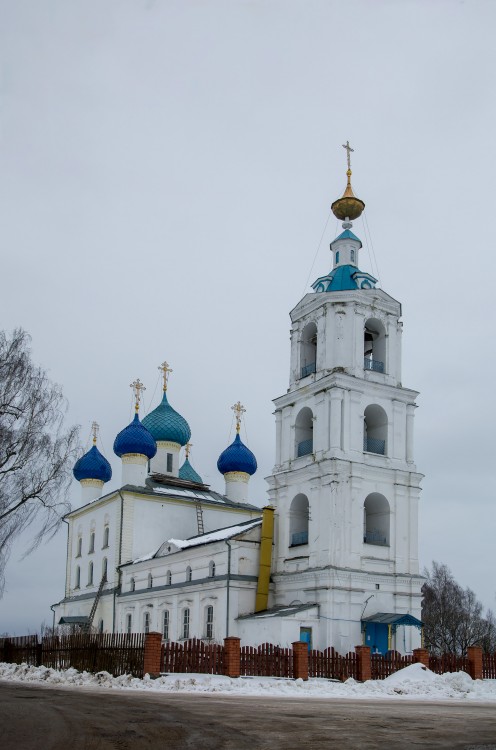
Image resolution: width=496 pixels, height=750 pixels. What are the coordinates of `door` in the screenshot? It's located at (383, 642).